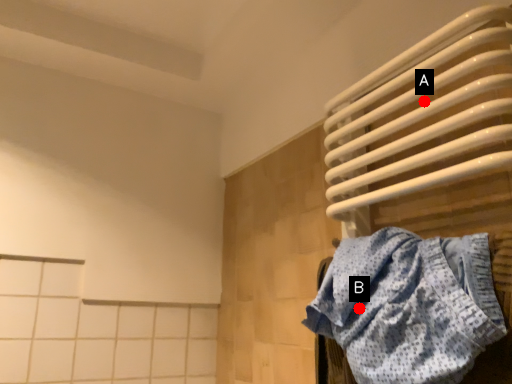
Question: Two points are circled on the image, labeled by A and B beside each circle. Which point is farther to the camera?

Choices:
 (A) A is further
 (B) B is further

Answer: (A)